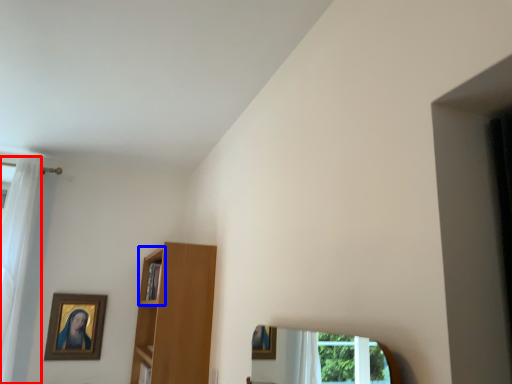
Question: Which point is closer to the camera, curtain (highlighted by a red box) or cabinet (highlighted by a blue box)?

Choices:
 (A) curtain
 (B) cabinet

Answer: (B)